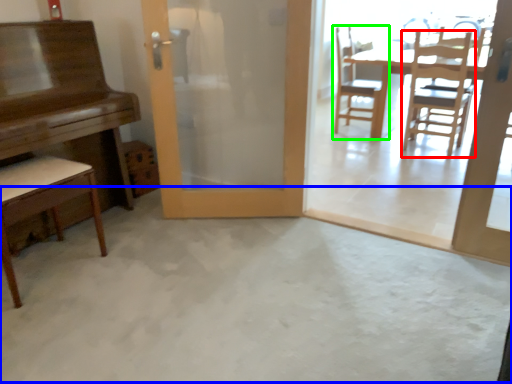
Question: Based on their relative distances, which object is nearer to chair (highlighted by a red box)? Choose from concrete (highlighted by a blue box) and chair (highlighted by a green box).

Choices:
 (A) concrete
 (B) chair

Answer: (B)